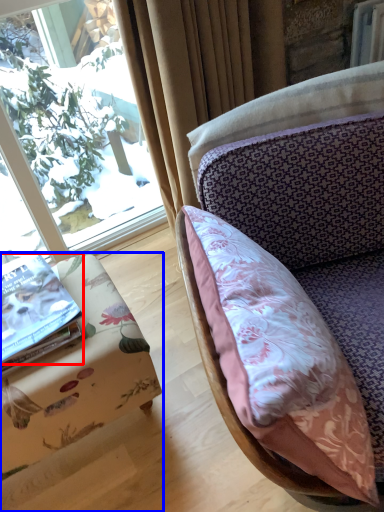
Question: Which object is further to the camera taking this photo, book (highlighted by a red box) or furniture (highlighted by a blue box)?

Choices:
 (A) book
 (B) furniture

Answer: (A)